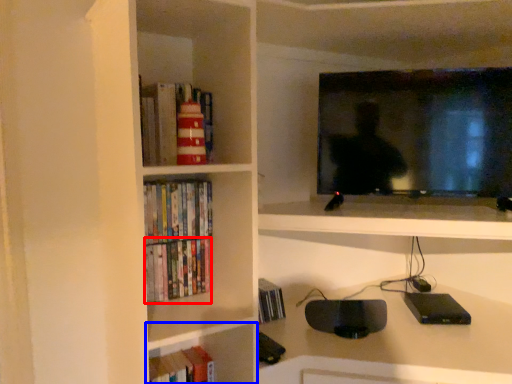
Question: Which object is closer to the camera taking this photo, book (highlighted by a red box) or shelf (highlighted by a blue box)?

Choices:
 (A) book
 (B) shelf

Answer: (A)